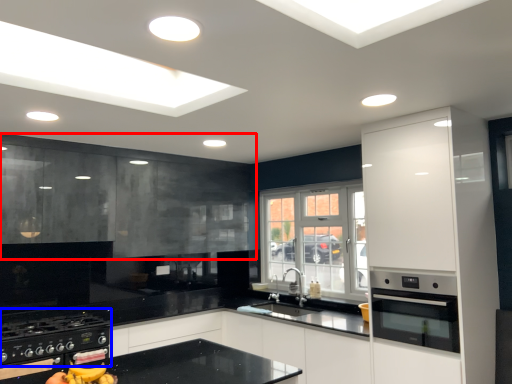
Question: Which point is closer to the camera, cabinetry (highlighted by a red box) or gas stove (highlighted by a blue box)?

Choices:
 (A) cabinetry
 (B) gas stove

Answer: (B)